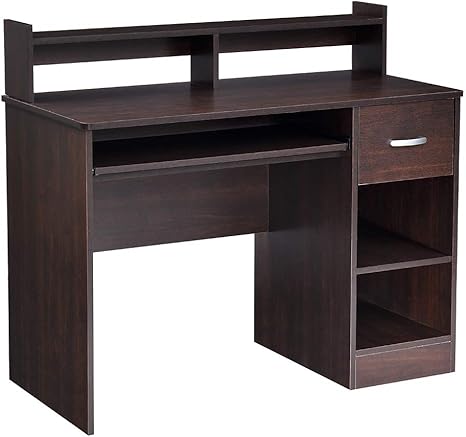
This screenshot has width=466, height=437. Identify the location of drawer. tap(393, 169).